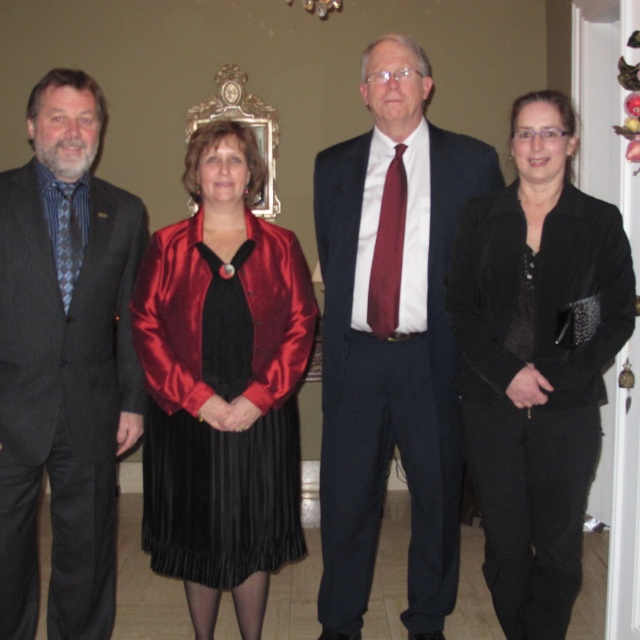
Question: Among these objects, which one is farthest from the camera?

Choices:
 (A) matte black suit at left
 (B) satin black dress at center

Answer: (B)

Question: Does velvet black jacket at center come in front of burgundy silk tie at center?

Choices:
 (A) no
 (B) yes

Answer: (B)

Question: Which is farther from the matte black suit at center?

Choices:
 (A) burgundy silk tie at center
 (B) velvet black jacket at center

Answer: (B)

Question: Does velvet black jacket at center have a lesser width compared to satin black dress at center?

Choices:
 (A) yes
 (B) no

Answer: (A)

Question: Can you confirm if matte black suit at left is positioned to the right of burgundy silk tie at center?

Choices:
 (A) no
 (B) yes

Answer: (A)

Question: Which point appears closest to the camera in this image?

Choices:
 (A) (440, 524)
 (B) (600, 275)
 (C) (90, 129)
 (D) (307, 269)

Answer: (B)